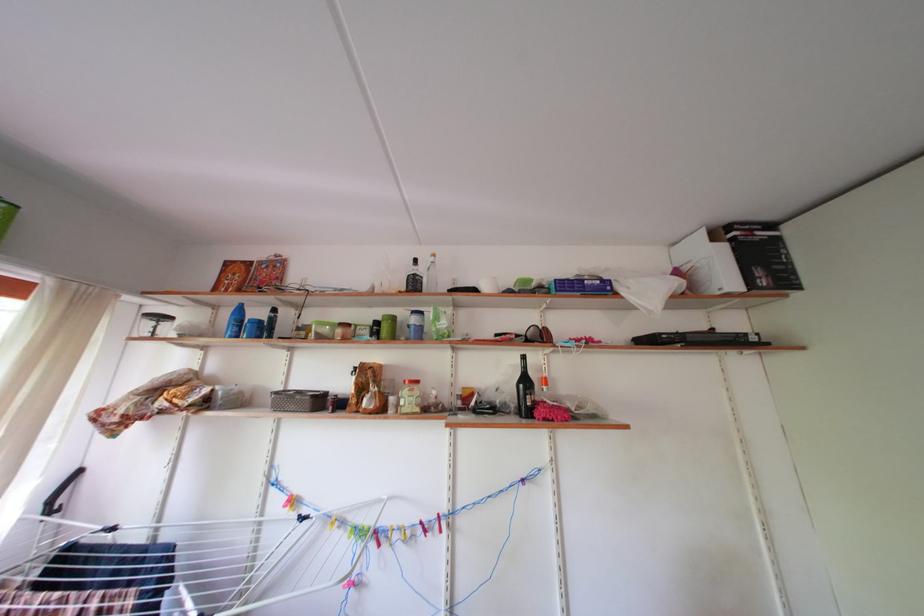
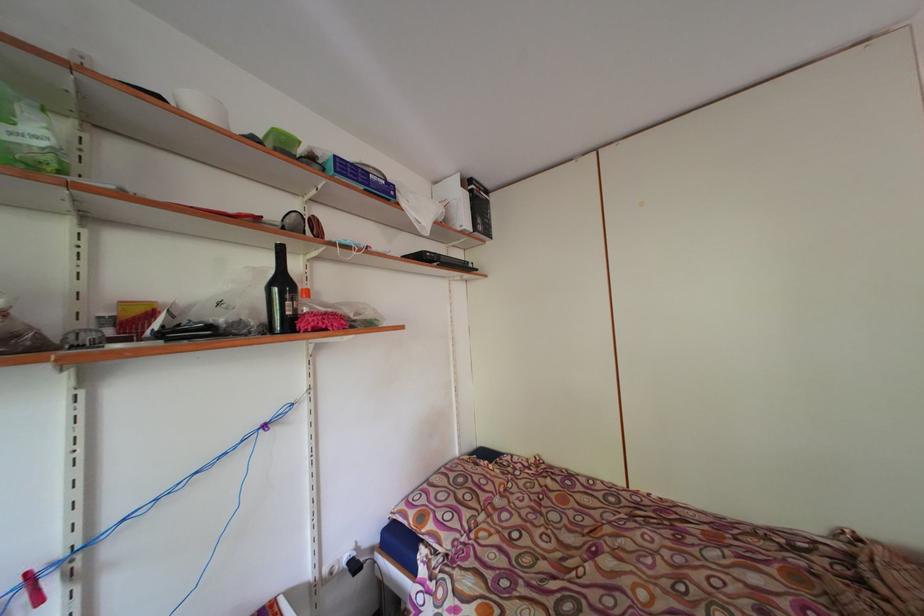
Find the pixel in the second image that matches the point at 591,286 in the first image.

(377, 180)